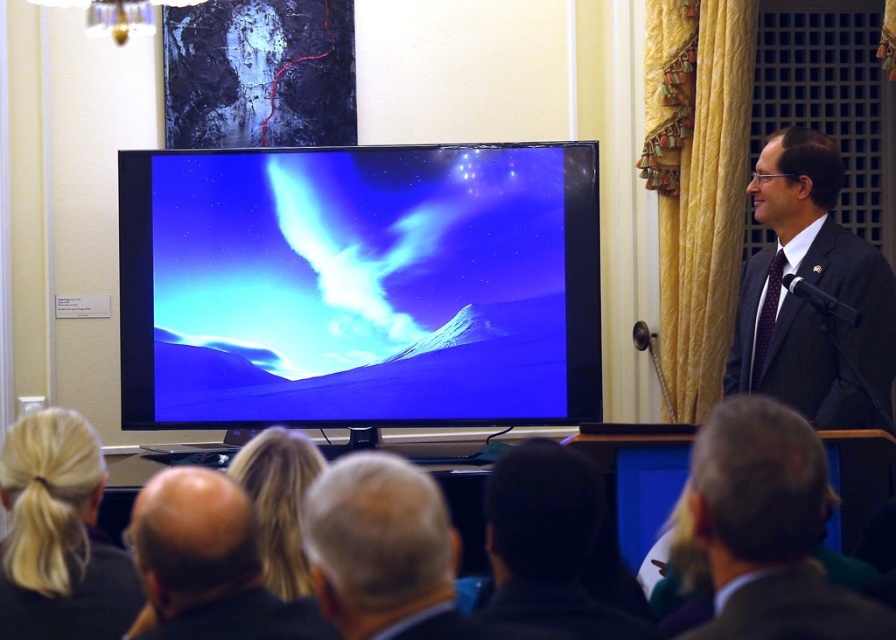
Does matte blue screen at center have a lesser height compared to dark brown hair at lower center?

In fact, matte blue screen at center may be taller than dark brown hair at lower center.

You are a GUI agent. You are given a task and a screenshot of the screen. Output one action in this format:
    pyautogui.click(x=<x>, y=<y>)
    Task: Click on the matte blue screen at center
    This screenshot has height=640, width=896.
    Given the screenshot: What is the action you would take?
    pyautogui.click(x=359, y=285)

Does smooth gray suit at right have a lesser width compared to blonde hair at lower left?

Yes, smooth gray suit at right is thinner than blonde hair at lower left.

Between smooth gray suit at right and blonde hair at lower left, which one appears on the left side from the viewer's perspective?

blonde hair at lower left is more to the left.

Is point (840, 625) behind point (29, 628)?

No, it is not.

Identify the location of smooth gray suit at right. This screenshot has width=896, height=640. (768, 529).

Between bald head at lower left and blonde hair at lower center, which one is positioned higher?

Positioned higher is blonde hair at lower center.

Is bald head at lower left bigger than blonde hair at lower center?

Yes.

This screenshot has height=640, width=896. Describe the element at coordinates (207, 564) in the screenshot. I see `bald head at lower left` at that location.

Locate an element on the screen. This screenshot has width=896, height=640. bald head at lower left is located at coordinates (207, 564).